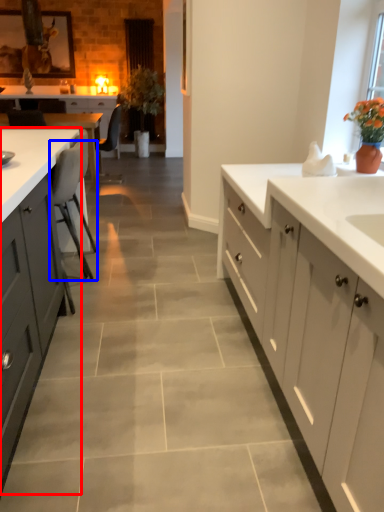
Question: Which of the following is the closest to the observer, cabinetry (highlighted by a red box) or chair (highlighted by a blue box)?

Choices:
 (A) cabinetry
 (B) chair

Answer: (A)